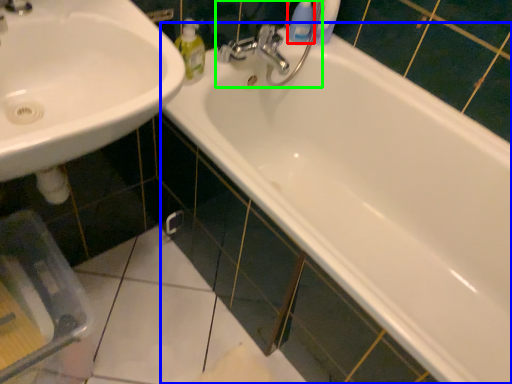
Question: Based on their relative distances, which object is nearer to cleaning product (highlighted by a red box)? Choose from bathtub (highlighted by a blue box) and plumbing fixture (highlighted by a green box).

Choices:
 (A) bathtub
 (B) plumbing fixture

Answer: (B)